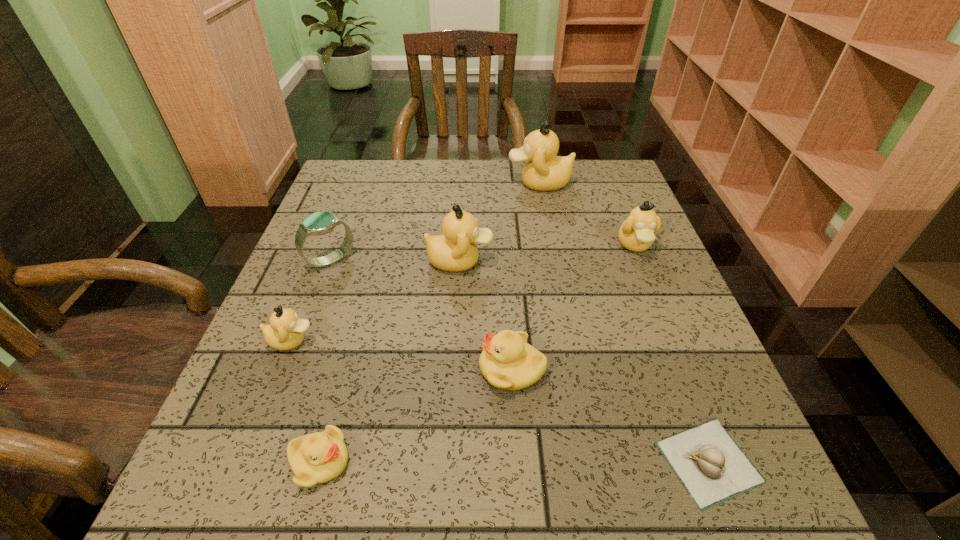
Where is `vacant area that lies between the garlic and the seventh shortest object`? vacant area that lies between the garlic and the seventh shortest object is located at coordinates (585, 362).

The image size is (960, 540). In order to click on empty space between the leftmost duckling and the third tallest duckling in this screenshot , I will do `click(463, 293)`.

Locate an element on the screen. free spot between the smallest tan duckling and the farthest duckling is located at coordinates (416, 262).

Find the location of a particular element. unoccupied area between the nearest duckling and the third biggest tan duckling is located at coordinates (477, 353).

Where is `empty space that is in between the farthest object and the blue watch`? This screenshot has width=960, height=540. empty space that is in between the farthest object and the blue watch is located at coordinates click(x=435, y=221).

This screenshot has height=540, width=960. What are the coordinates of `unoccupied area between the tallest object and the leftmost duckling` in the screenshot? It's located at (416, 262).

Where is `vacant point located between the third tallest duckling and the second tan duckling from right to left`? vacant point located between the third tallest duckling and the second tan duckling from right to left is located at coordinates (587, 214).

What are the coordinates of `vacant space that's between the right yellow duckling and the garlic` in the screenshot? It's located at (611, 415).

At what (x,y) coordinates should I click in order to perform the action: click on unoccupied position between the smaller yellow duckling and the second tan duckling from right to left. Please return your answer as a coordinate pair (x, y). This screenshot has width=960, height=540. Looking at the image, I should click on [x=429, y=322].

Locate an element on the screen. free area in between the nearest tan duckling and the fifth shortest duckling is located at coordinates (375, 301).